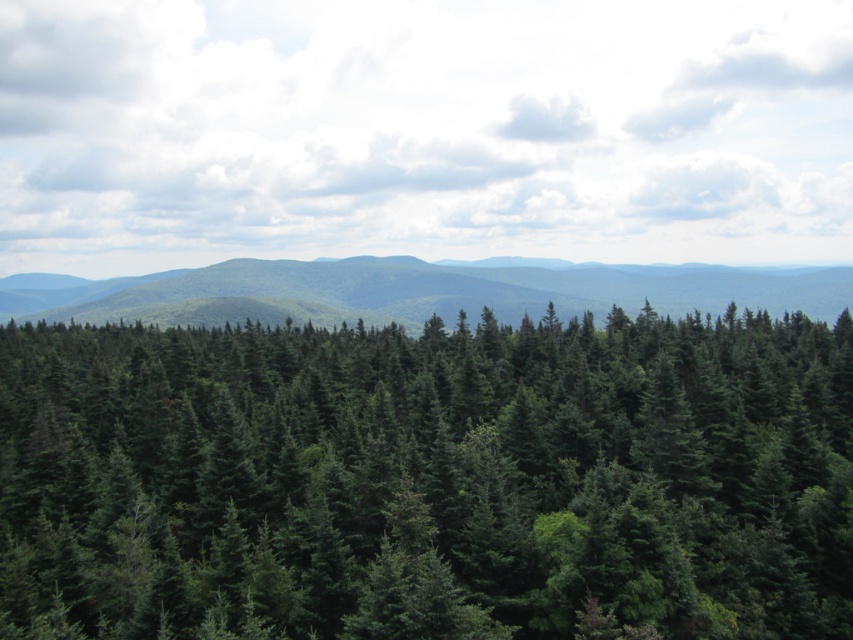
Question: Which point is farther to the camera?

Choices:
 (A) (42, 296)
 (B) (560, 536)

Answer: (A)

Question: Is green matte pine forest at center to the left of green matte forest at center from the viewer's perspective?

Choices:
 (A) no
 (B) yes

Answer: (B)

Question: Which point is closer to the camera?

Choices:
 (A) green matte pine forest at center
 (B) green matte forest at center

Answer: (A)

Question: In this image, where is green matte pine forest at center located relative to green matte forest at center?

Choices:
 (A) below
 (B) above

Answer: (A)

Question: Which of the following is the closest to the observer?

Choices:
 (A) (448, 484)
 (B) (157, 282)

Answer: (A)

Question: Is green matte pine forest at center below green matte forest at center?

Choices:
 (A) no
 (B) yes

Answer: (B)